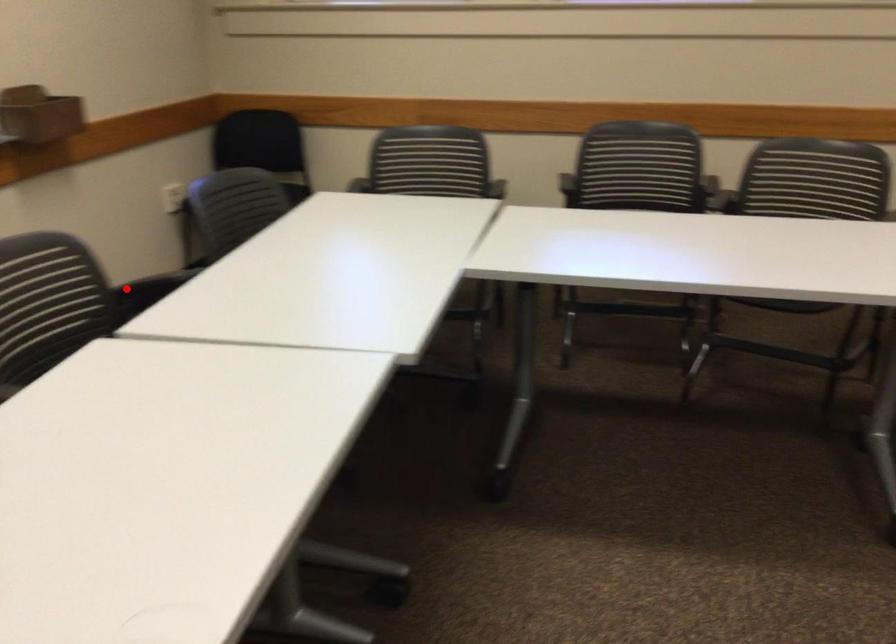
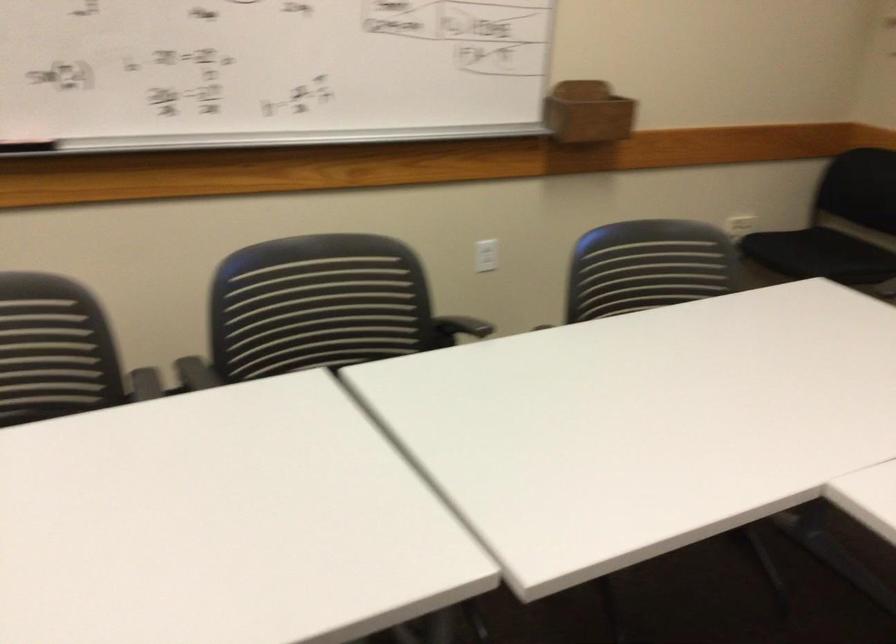
Question: I am providing you with two images of the same scene from different viewpoints. A red point is shown in image1. For the corresponding object point in image2, is it positioned nearer or farther from the camera?

Choices:
 (A) Nearer
 (B) Farther

Answer: (A)